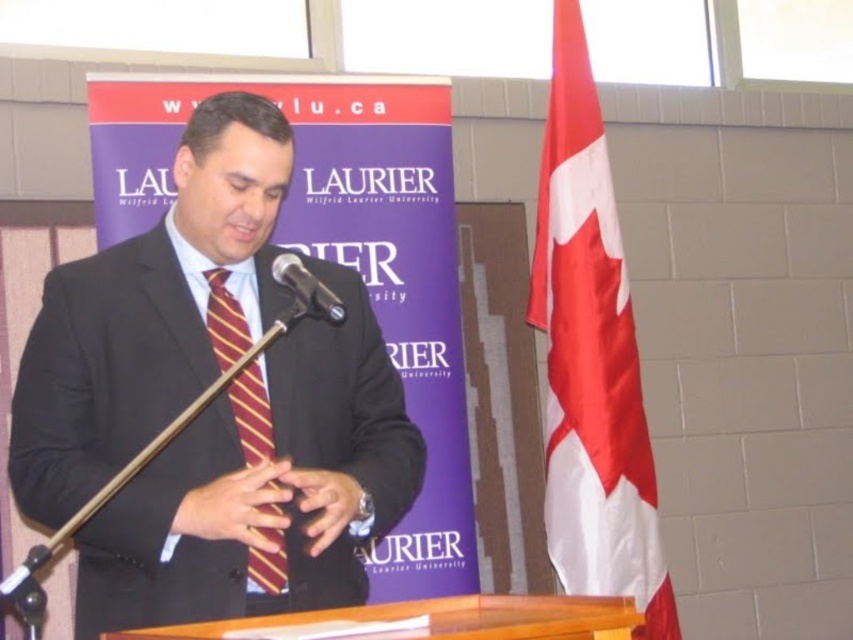
Question: Does matte black suit at center appear under silky fabric flag at right?

Choices:
 (A) no
 (B) yes

Answer: (B)

Question: Among these objects, which one is nearest to the camera?

Choices:
 (A) silky fabric flag at right
 (B) black metallic microphone at center
 (C) maroon striped tie at center

Answer: (C)

Question: Which of the following is the closest to the observer?

Choices:
 (A) matte black suit at center
 (B) silky fabric flag at right
 (C) black metallic microphone at center

Answer: (A)

Question: Which of the following is the closest to the observer?

Choices:
 (A) (149, 584)
 (B) (288, 285)
 (C) (544, 241)
 (D) (250, 388)

Answer: (A)

Question: Is silky fabric flag at right below maroon striped tie at center?

Choices:
 (A) no
 (B) yes

Answer: (A)

Question: Is matte black suit at center below silky fabric flag at right?

Choices:
 (A) yes
 (B) no

Answer: (A)